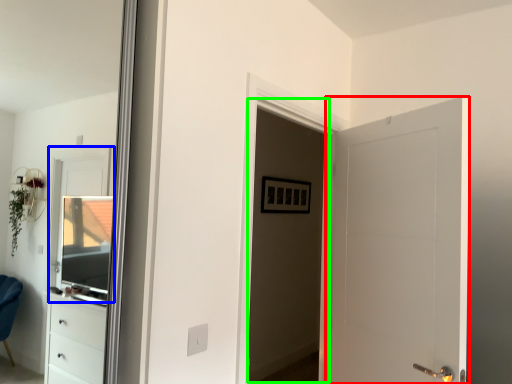
Question: Which is farther away from door (highlighted by a red box)? window (highlighted by a blue box) or screen door (highlighted by a green box)?

Choices:
 (A) window
 (B) screen door

Answer: (A)